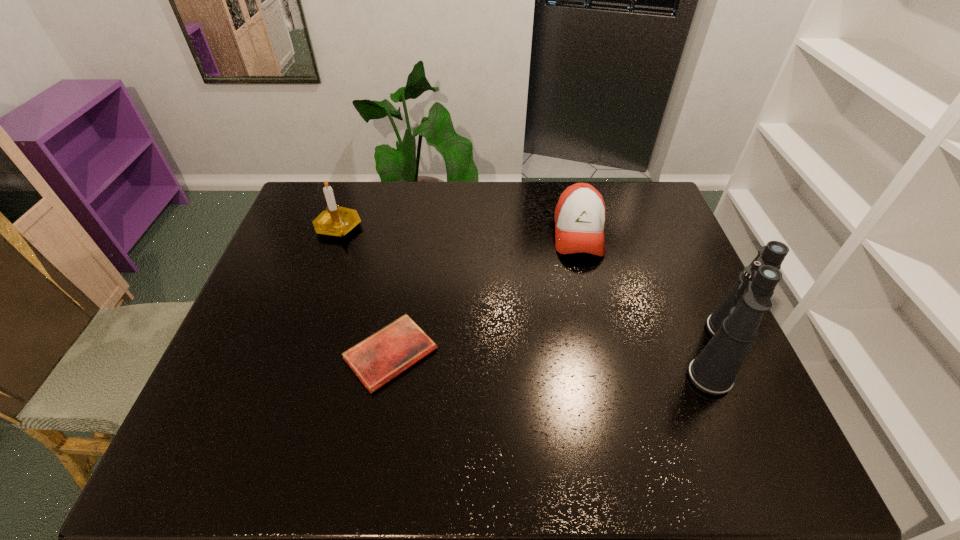
Locate an element on the screen. vacant space on the desktop that is between the shortest object and the rightmost object and is positioned on the front-facing side of the baseball cap is located at coordinates pos(590,353).

At what (x,y) coordinates should I click in order to perform the action: click on free space on the desktop that is between the diary and the rightmost object and is positioned with a handle on the candle holder. Please return your answer as a coordinate pair (x, y). This screenshot has height=540, width=960. Looking at the image, I should click on (509, 354).